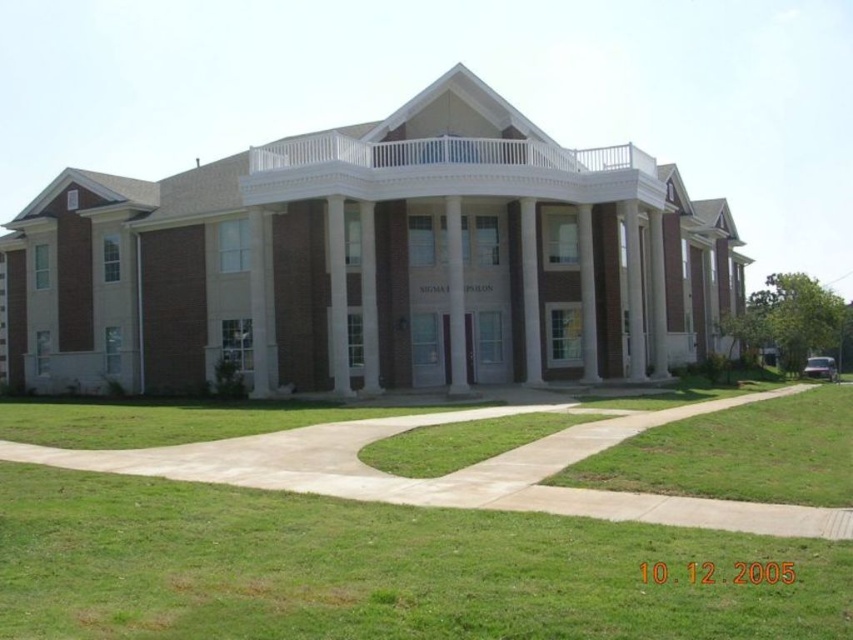
You are a GUI agent. You are given a task and a screenshot of the screen. Output one action in this format:
    pyautogui.click(x=<x>, y=<y>)
    Task: Click on the green grass at lower center
    Image resolution: width=853 pixels, height=640 pixels.
    Given the screenshot: What is the action you would take?
    pyautogui.click(x=389, y=564)

Does green grass at lower center appear on the right side of green grass at lower right?

Incorrect, green grass at lower center is not on the right side of green grass at lower right.

Locate an element on the screen. This screenshot has height=640, width=853. green grass at lower center is located at coordinates (389, 564).

Is green grass at lower center further to camera compared to white marble pillar at center?

That is False.

The image size is (853, 640). I want to click on green grass at lower center, so click(x=389, y=564).

Is point (560, 160) closer to viewer compared to point (448, 296)?

Yes.

Which of these two, white painted wood porch at upper center or white marble pillar at center, stands taller?

With more height is white painted wood porch at upper center.

Where is `white painted wood porch at upper center`? The image size is (853, 640). white painted wood porch at upper center is located at coordinates (440, 154).